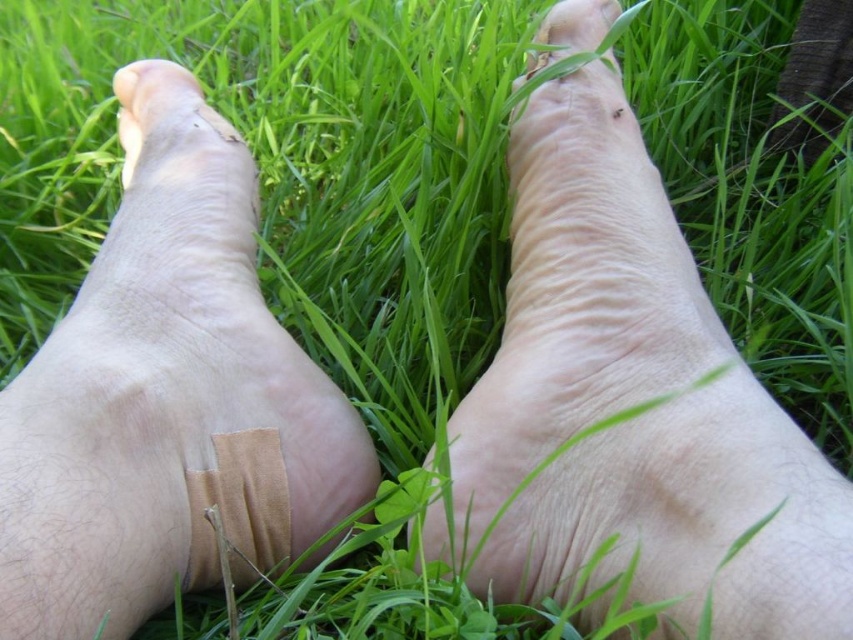
How much distance is there between transparent beige bandage at lower left and beige fabric bandage at center?

transparent beige bandage at lower left and beige fabric bandage at center are 4.15 inches apart.

Which of these two, transparent beige bandage at lower left or beige fabric bandage at center, stands taller?

transparent beige bandage at lower left

Who is more distant from viewer, (120,486) or (193,556)?

Positioned behind is point (193,556).

Image resolution: width=853 pixels, height=640 pixels. Identify the location of transparent beige bandage at lower left. (166, 404).

Measure the distance between smooth skin leg at upper right and camera.

smooth skin leg at upper right and camera are 13.75 inches apart from each other.

Is smooth skin leg at upper right below beige fabric bandage at center?

No.

Is point (492, 484) closer to camera compared to point (250, 438)?

Yes, point (492, 484) is closer to viewer.

This screenshot has height=640, width=853. Find the location of `smooth skin leg at upper right`. smooth skin leg at upper right is located at coordinates (579, 292).

Is smooth skin leg at upper right above transparent beige bandage at lower left?

Correct, smooth skin leg at upper right is located above transparent beige bandage at lower left.

This screenshot has height=640, width=853. Describe the element at coordinates (579, 292) in the screenshot. I see `smooth skin leg at upper right` at that location.

You are a GUI agent. You are given a task and a screenshot of the screen. Output one action in this format:
    pyautogui.click(x=<x>, y=<y>)
    Task: Click on the smooth skin leg at upper right
    The height and width of the screenshot is (640, 853).
    Given the screenshot: What is the action you would take?
    pyautogui.click(x=579, y=292)